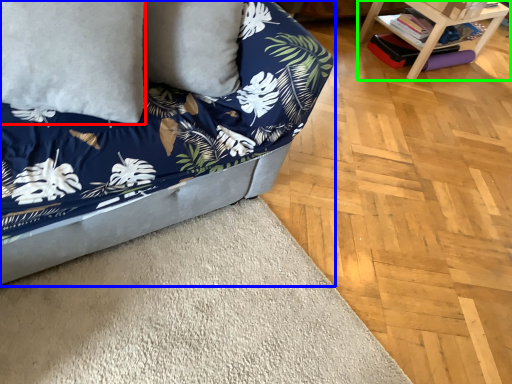
Question: Which object is the closest to the pillow (highlighted by a red box)? Choose among these: studio couch (highlighted by a blue box) or table (highlighted by a green box).

Choices:
 (A) studio couch
 (B) table

Answer: (A)